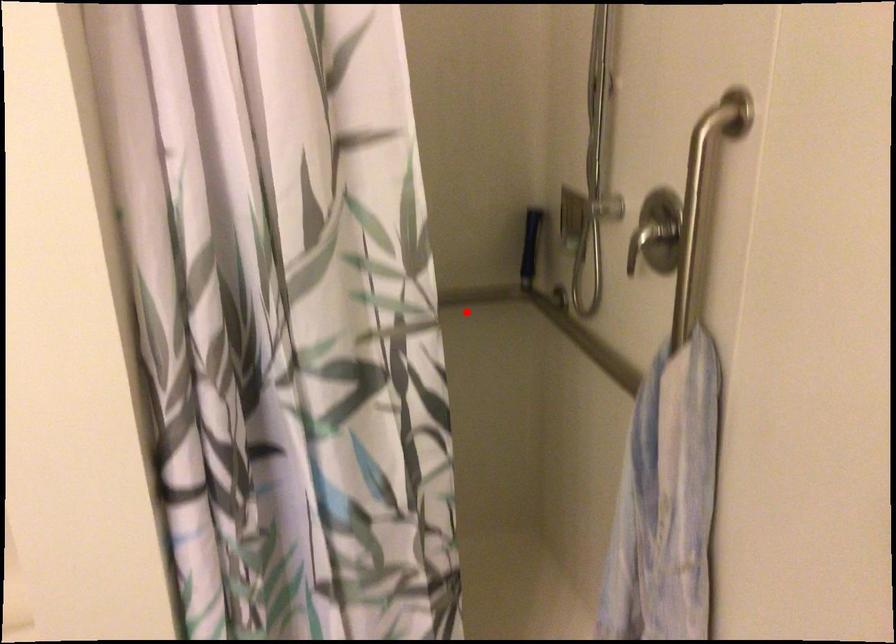
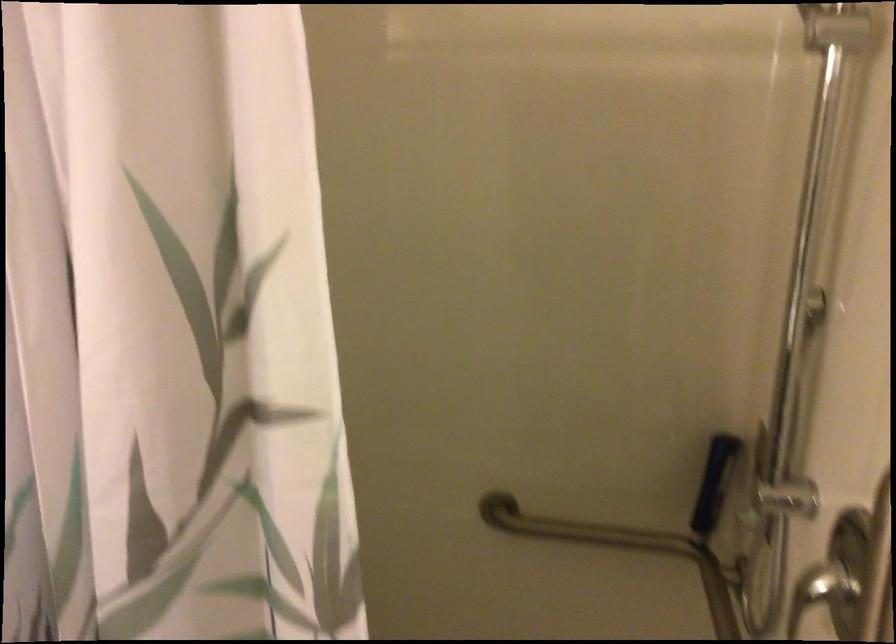
Locate, in the second image, the point that corresponds to the highlighted location in the first image.

(622, 549)